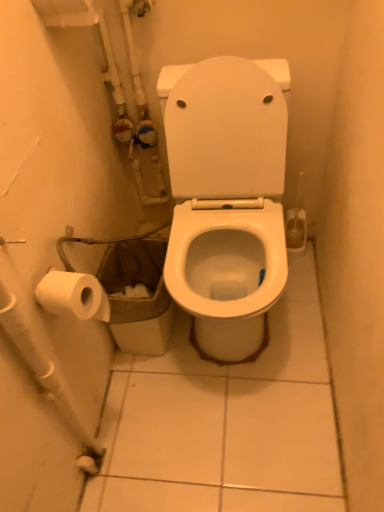
Describe the element at coordinates (137, 298) in the screenshot. This screenshot has width=384, height=512. I see `brown paper bag at lower left` at that location.

Identify the location of white glossy toilet at center. (226, 198).

The image size is (384, 512). What do you see at coordinates (47, 376) in the screenshot?
I see `white plastic water pipe at lower left` at bounding box center [47, 376].

I want to click on brown paper bag at lower left, so click(137, 298).

From the image's perspective, which object appears higher, brown paper bag at lower left or white glossy toilet at center?

white glossy toilet at center is shown above in the image.

Does point (130, 258) come closer to viewer compared to point (182, 301)?

No, (130, 258) is further to viewer.

Does brown paper bag at lower left have a greater height compared to white glossy toilet at center?

No.

Is brown paper bag at lower left not within white plastic water pipe at lower left?

Yes, brown paper bag at lower left is located beyond the bounds of white plastic water pipe at lower left.

The width and height of the screenshot is (384, 512). What are the coordinates of `garbage lying on the right of white plastic water pipe at lower left` in the screenshot? It's located at (137, 298).

From a real-world perspective, is brown paper bag at lower left physically located above or below white plastic water pipe at lower left?

From a real-world perspective, brown paper bag at lower left is physically below white plastic water pipe at lower left.

Considering the sizes of objects white plastic water pipe at lower left and white glossy toilet at center in the image provided, who is bigger, white plastic water pipe at lower left or white glossy toilet at center?

With larger size is white glossy toilet at center.

Which is more to the right, white plastic water pipe at lower left or white glossy toilet at center?

white glossy toilet at center is more to the right.

In terms of height, does white plastic water pipe at lower left look taller or shorter compared to white glossy toilet at center?

Clearly, white plastic water pipe at lower left is shorter compared to white glossy toilet at center.

Is brown paper bag at lower left at the back of white glossy toilet at center?

That's not correct — white glossy toilet at center is not looking away from brown paper bag at lower left.

Is point (203, 277) closer to camera compared to point (161, 288)?

Yes, it is.

From a real-world perspective, is white glossy toilet at center positioned under brown paper bag at lower left based on gravity?

No, from a real-world perspective, white glossy toilet at center is not under brown paper bag at lower left.

This screenshot has height=512, width=384. I want to click on toilet located on the right of brown paper bag at lower left, so click(226, 198).

Is white glossy toilet at center touching white plastic water pipe at lower left?

There is a gap between white glossy toilet at center and white plastic water pipe at lower left.

Is white glossy toilet at center bigger or smaller than white plastic water pipe at lower left?

Considering their sizes, white glossy toilet at center takes up more space than white plastic water pipe at lower left.

Which of these two, white glossy toilet at center or white plastic water pipe at lower left, stands taller?

white glossy toilet at center.

Is white plastic water pipe at lower left aimed at brown paper bag at lower left?

No, white plastic water pipe at lower left is not oriented towards brown paper bag at lower left.

Is white plastic water pipe at lower left positioned far away from brown paper bag at lower left?

white plastic water pipe at lower left is actually quite close to brown paper bag at lower left.

In the image, is white plastic water pipe at lower left positioned in front of or behind brown paper bag at lower left?

white plastic water pipe at lower left is positioned closer to the viewer than brown paper bag at lower left.

From a real-world perspective, is white plastic water pipe at lower left on brown paper bag at lower left?

Indeed, from a real-world perspective, white plastic water pipe at lower left stands above brown paper bag at lower left.

Where is `garbage that is below the white glossy toilet at center (from the image's perspective)`? Image resolution: width=384 pixels, height=512 pixels. garbage that is below the white glossy toilet at center (from the image's perspective) is located at coordinates (137, 298).

At what (x,y) coordinates should I click in order to perform the action: click on water pipe that appears above the brown paper bag at lower left (from a real-world perspective). Please return your answer as a coordinate pair (x, y). Looking at the image, I should click on (47, 376).

Considering their positions, is brown paper bag at lower left positioned further to white plastic water pipe at lower left than white glossy toilet at center?

Among the two, white glossy toilet at center is located further to white plastic water pipe at lower left.

When comparing their distances from white plastic water pipe at lower left, does white glossy toilet at center or brown paper bag at lower left seem closer?

brown paper bag at lower left is positioned closer to the anchor white plastic water pipe at lower left.

Considering their positions, is white glossy toilet at center positioned closer to brown paper bag at lower left than white plastic water pipe at lower left?

white glossy toilet at center is closer to brown paper bag at lower left.

Which object lies nearer to the anchor point white glossy toilet at center, white plastic water pipe at lower left or brown paper bag at lower left?

brown paper bag at lower left is positioned closer to the anchor white glossy toilet at center.

Based on their spatial positions, is brown paper bag at lower left or white plastic water pipe at lower left further from white glossy toilet at center?

white plastic water pipe at lower left lies further to white glossy toilet at center than the other object.

Based on their spatial positions, is white plastic water pipe at lower left or white glossy toilet at center further from brown paper bag at lower left?

white plastic water pipe at lower left lies further to brown paper bag at lower left than the other object.

Find the location of a particular element. The height and width of the screenshot is (512, 384). toilet between white plastic water pipe at lower left and brown paper bag at lower left in the front-back direction is located at coordinates (226, 198).